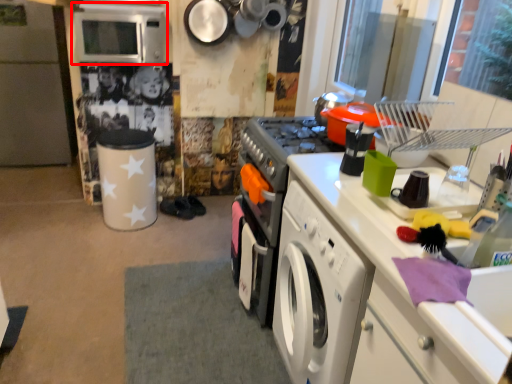
Question: From the image's perspective, considering the relative positions of microwave oven (annotated by the red box) and fridge in the image provided, where is microwave oven (annotated by the red box) located with respect to the staircase?

Choices:
 (A) above
 (B) below

Answer: (A)